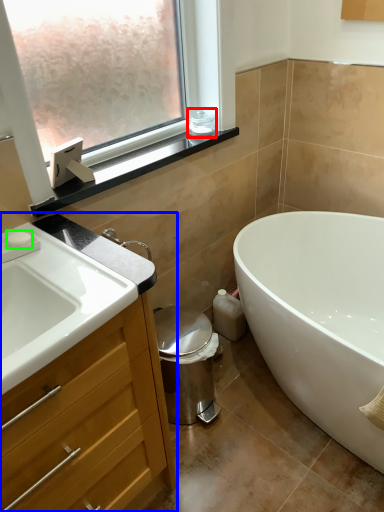
Question: Which object is positioned closest to toiletry (highlighted by a red box)? Select from bathroom cabinet (highlighted by a blue box) and soap (highlighted by a green box).

Choices:
 (A) bathroom cabinet
 (B) soap

Answer: (B)